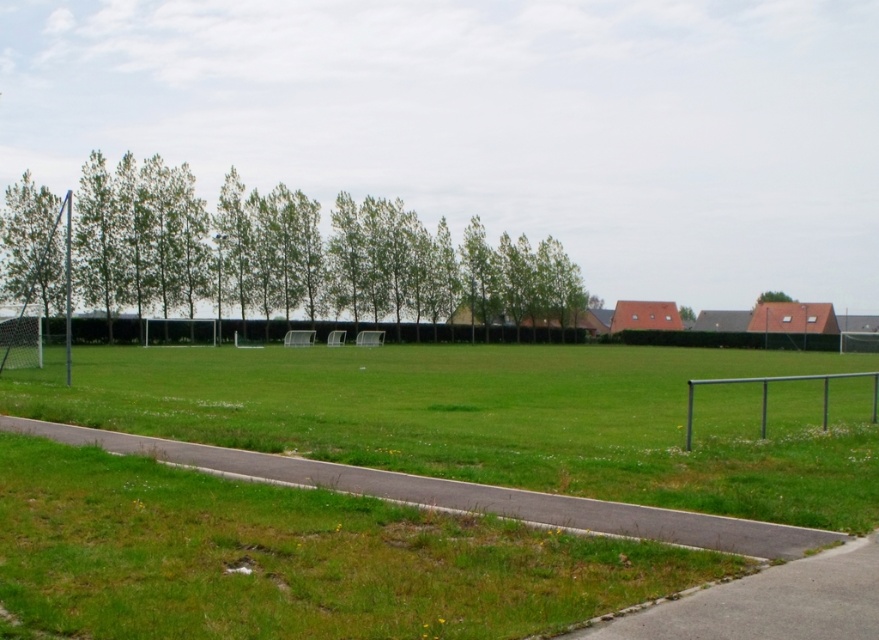
Question: In this image, where is gray asphalt pavement at lower right located relative to green leafy tree at left?

Choices:
 (A) below
 (B) above

Answer: (A)

Question: Which is farther from the green metallic fence at lower right?

Choices:
 (A) green leafy tree at left
 (B) green leafy trees at left

Answer: (A)

Question: Which point is farther to the camera?

Choices:
 (A) green leafy trees at left
 (B) gray asphalt pavement at lower right
 (C) gravel path at lower center

Answer: (A)

Question: Which point is closer to the camera taking this photo?

Choices:
 (A) (689, 436)
 (B) (13, 237)
 (C) (291, 243)
 (D) (805, 596)

Answer: (D)

Question: Does gravel path at lower center have a smaller size compared to green leafy tree at left?

Choices:
 (A) yes
 (B) no

Answer: (A)

Question: Observing the image, what is the correct spatial positioning of green metallic fence at lower right in reference to green leafy tree at upper right?

Choices:
 (A) right
 (B) left

Answer: (B)